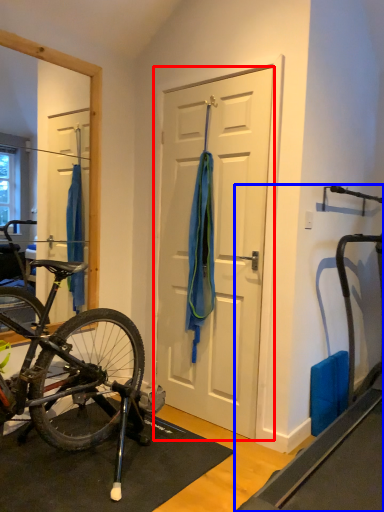
Question: Among these objects, which one is nearest to the camera, door (highlighted by a red box) or treadmill (highlighted by a blue box)?

Choices:
 (A) door
 (B) treadmill

Answer: (B)